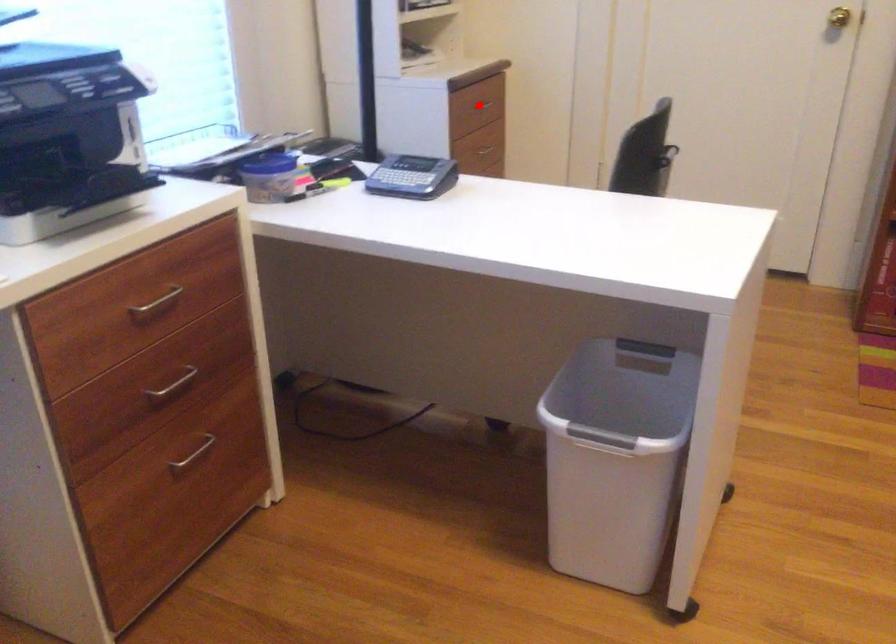
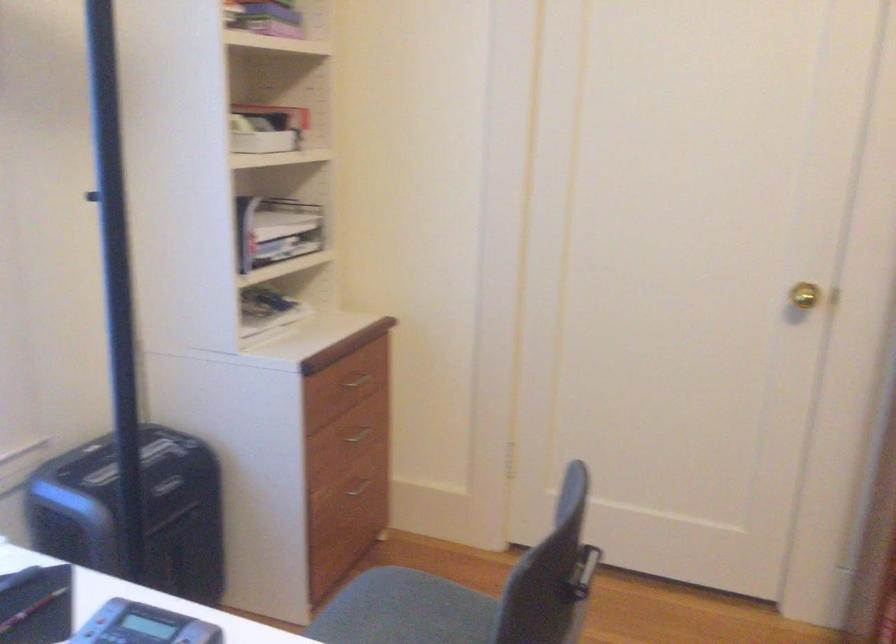
Locate, in the second image, the point that corresponds to the highlighted location in the first image.

(356, 381)